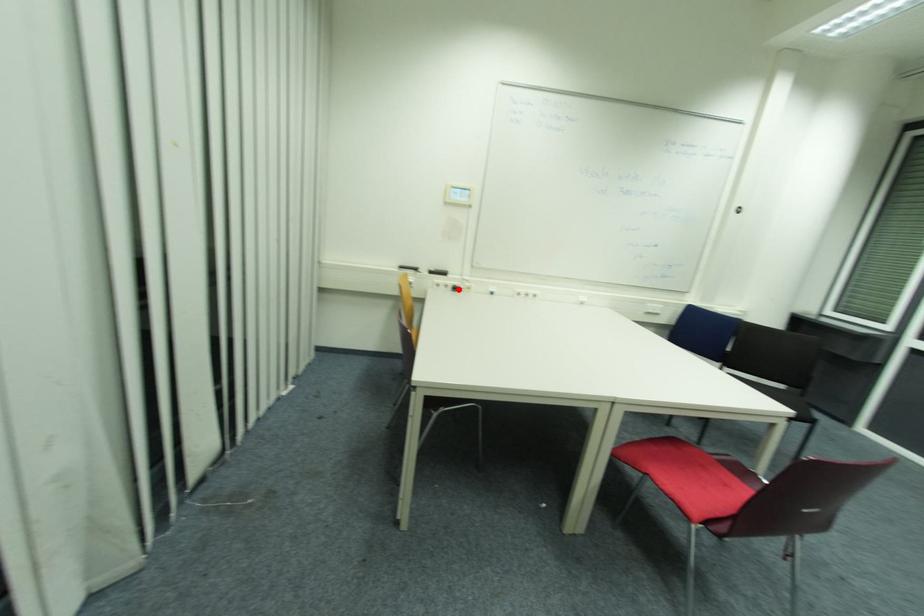
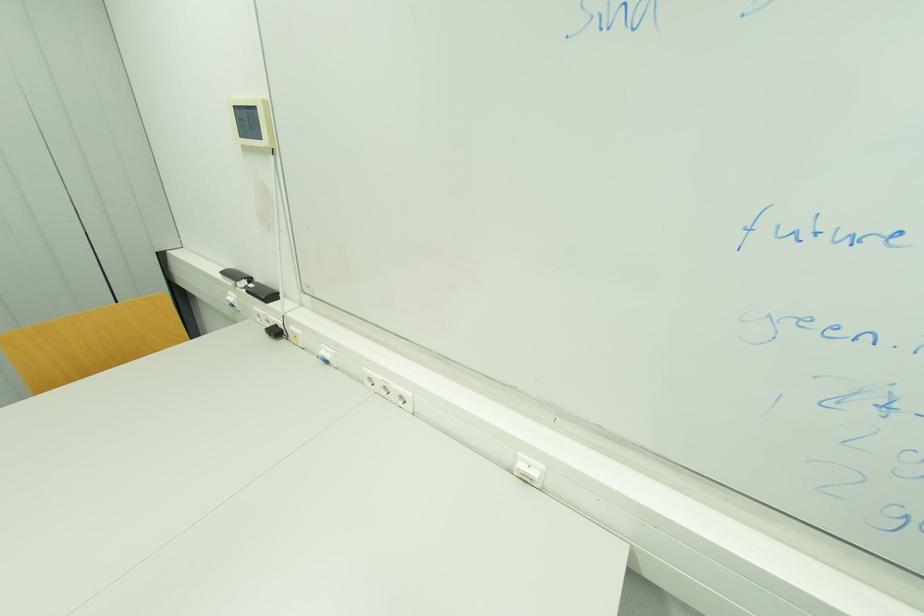
The point at the highlighted location is marked in the first image. Where is the corresponding point in the second image?

(281, 333)